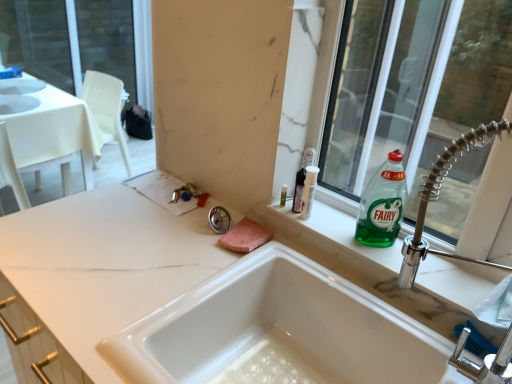
Where is `vacant space that's between transparent glass window at upper right and translucent plastic bottle at upper right`? vacant space that's between transparent glass window at upper right and translucent plastic bottle at upper right is located at coordinates (357, 231).